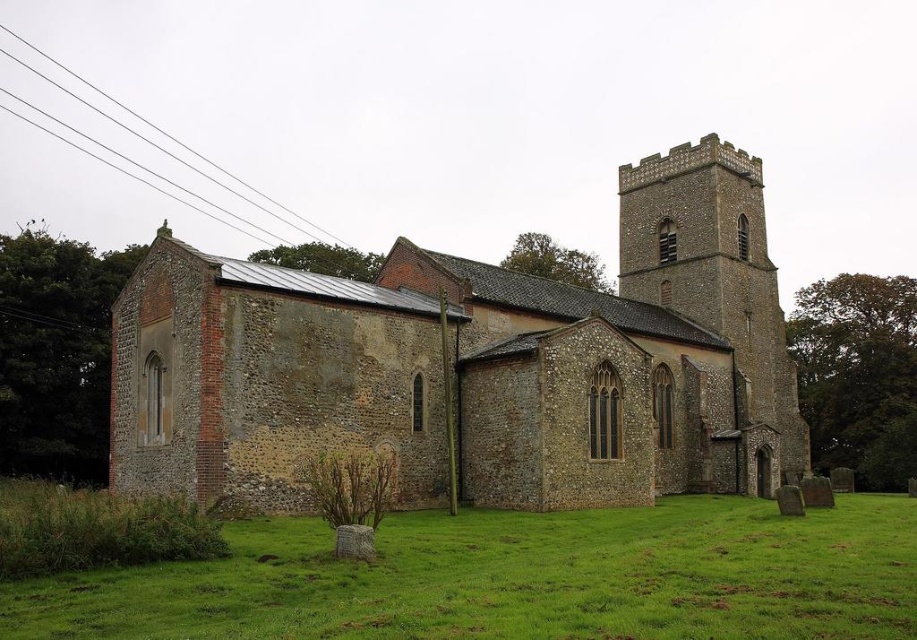
You are standing in front of the traditional stone church described. There is a specific point at coordinates point (297, 442) that you need to reach. If you can only move forward in a straight line, will you be able to reach that point without any obstacles?

The point (297, 442) is 50.90 meters away from you. Since you can move forward in a straight line and there are no mentioned obstacles in the scene description, you can reach it.

You are a tourist standing in front of the brown stone church at center and looking towards the brown stone church tower at upper right. Which structure appears taller from your vantage point?

The brown stone church tower at upper right appears taller than the brown stone church at center from your vantage point.